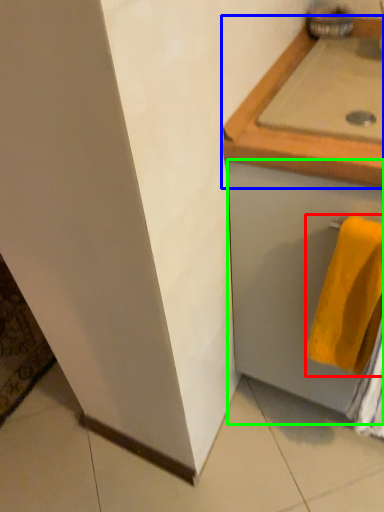
Question: Which object is positioned closest to towel (highlighted by a red box)? Select from countertop (highlighted by a blue box) and drawer (highlighted by a green box).

Choices:
 (A) countertop
 (B) drawer

Answer: (B)